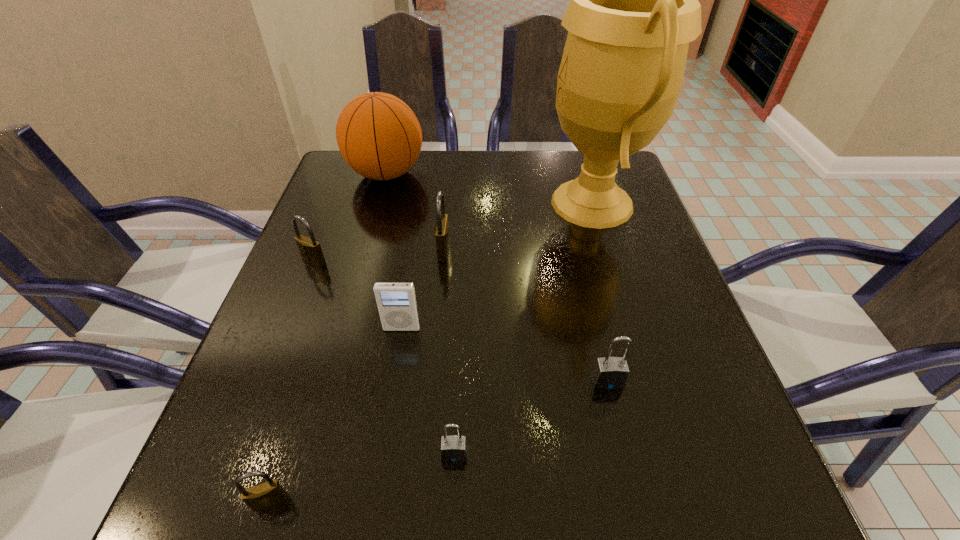
Image resolution: width=960 pixels, height=540 pixels. What are the coordinates of `free space between the seventh shortest object and the nearest object` in the screenshot? It's located at (327, 338).

The height and width of the screenshot is (540, 960). What are the coordinates of `vacant area between the tallest object and the third padlock from right to left` in the screenshot? It's located at (517, 227).

The image size is (960, 540). Identify the location of vacant space in between the trophy and the iPod. (497, 266).

Find the location of a particular element. The height and width of the screenshot is (540, 960). free spot between the second tallest object and the leftmost padlock is located at coordinates (350, 218).

Identify the location of unoccupied position between the third padlock from left to right and the nearest brass padlock. This screenshot has width=960, height=540. (356, 376).

You are a GUI agent. You are given a task and a screenshot of the screen. Output one action in this format:
    pyautogui.click(x=<x>, y=<y>)
    Task: Click on the free area in between the leftmost brass padlock and the rightmost brass padlock
    
    Given the screenshot: What is the action you would take?
    pyautogui.click(x=379, y=255)

The image size is (960, 540). I want to click on free space between the second biggest brass padlock and the smallest brass padlock, so click(x=292, y=381).

This screenshot has width=960, height=540. Find the location of `vacant area that lies between the second smallest brass padlock and the biggest brass padlock`. vacant area that lies between the second smallest brass padlock and the biggest brass padlock is located at coordinates (379, 255).

This screenshot has width=960, height=540. Find the location of `object that is the fourth closest to the leftmost brass padlock`. object that is the fourth closest to the leftmost brass padlock is located at coordinates (264, 495).

Choose which object is the fifth nearest neighbor to the iPod. Please provide its 2D coordinates. Your answer should be formatted as a tuple, i.e. [(x, y)], where the tuple contains the x and y coordinates of a point satisfying the conditions above.

[(634, 8)]